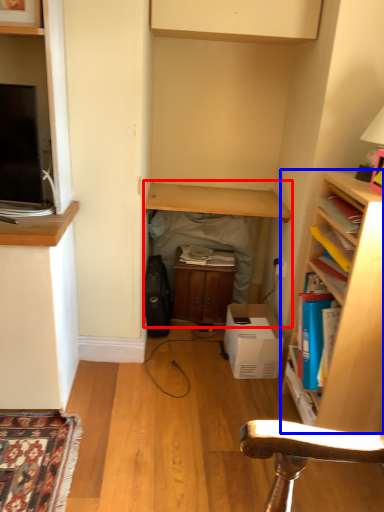
Question: Which object appears farthest to the camera in this image, table (highlighted by a red box) or shelf (highlighted by a blue box)?

Choices:
 (A) table
 (B) shelf

Answer: (A)